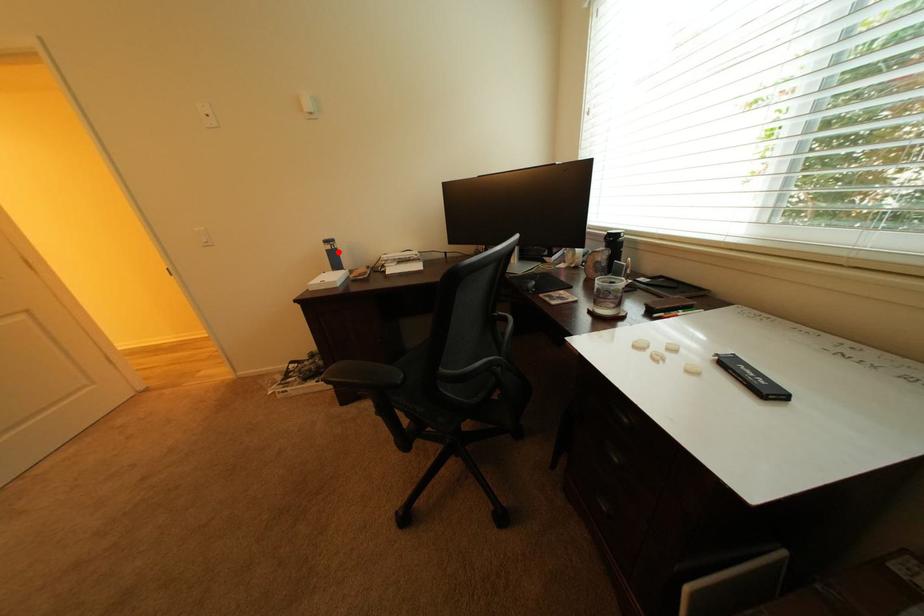
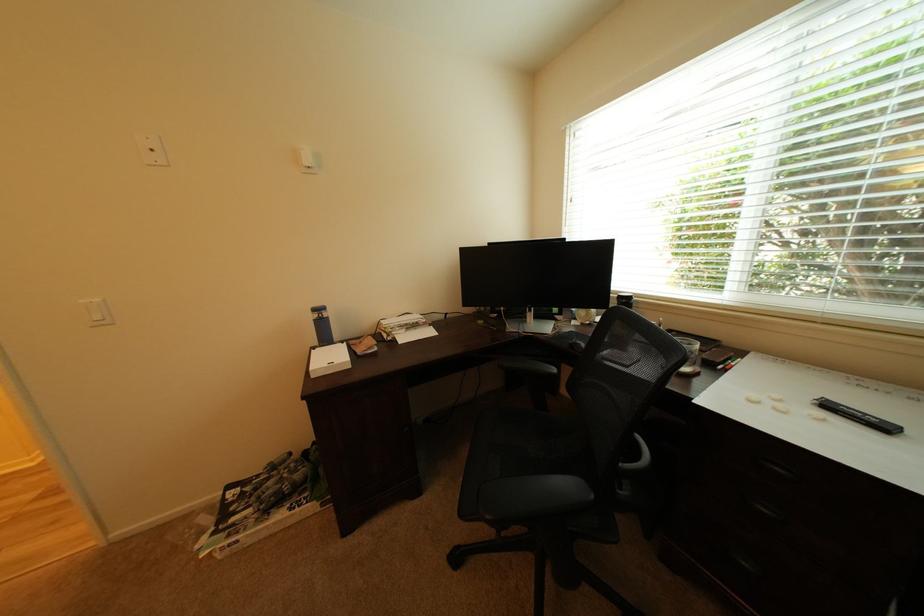
In the second image, find the point that corresponds to the highlighted location in the first image.

(324, 322)